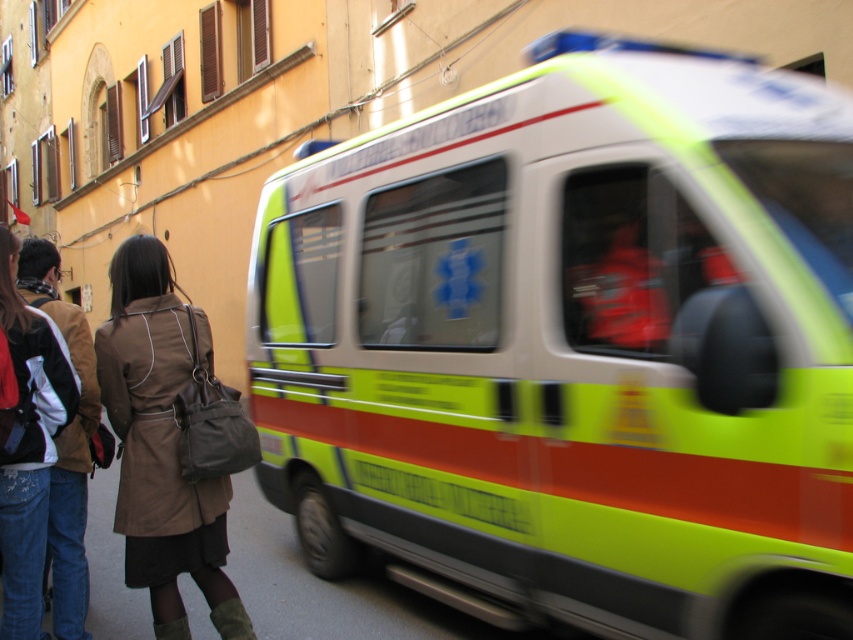
Question: Based on their relative distances, which object is farther from the brown leather jacket at lower left?

Choices:
 (A) brown leather coat at lower left
 (B) neon yellow/reflective ambulance at center

Answer: (B)

Question: Which of the following is the farthest from the observer?

Choices:
 (A) (790, 138)
 (B) (96, 360)
 (C) (62, 355)

Answer: (B)

Question: Is the position of neon yellow/reflective ambulance at center more distant than that of brown leather coat at lower left?

Choices:
 (A) no
 (B) yes

Answer: (A)

Question: Which point is closer to the camera?

Choices:
 (A) (688, 438)
 (B) (35, 321)

Answer: (A)

Question: Does neon yellow/reflective ambulance at center have a smaller size compared to brown leather jacket at lower left?

Choices:
 (A) yes
 (B) no

Answer: (B)

Question: Is neon yellow/reflective ambulance at center positioned in front of brown leather coat at lower left?

Choices:
 (A) yes
 (B) no

Answer: (A)